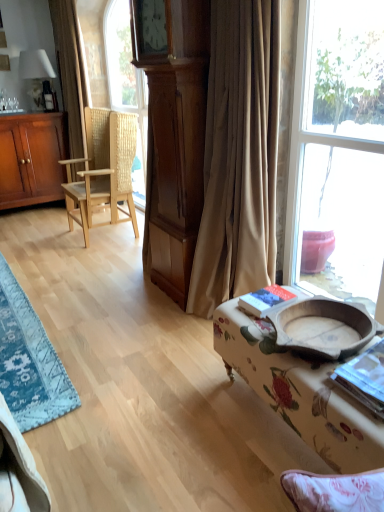
Where is `vacant space to the left of floral fabric ottoman at lower right`? The image size is (384, 512). vacant space to the left of floral fabric ottoman at lower right is located at coordinates (173, 424).